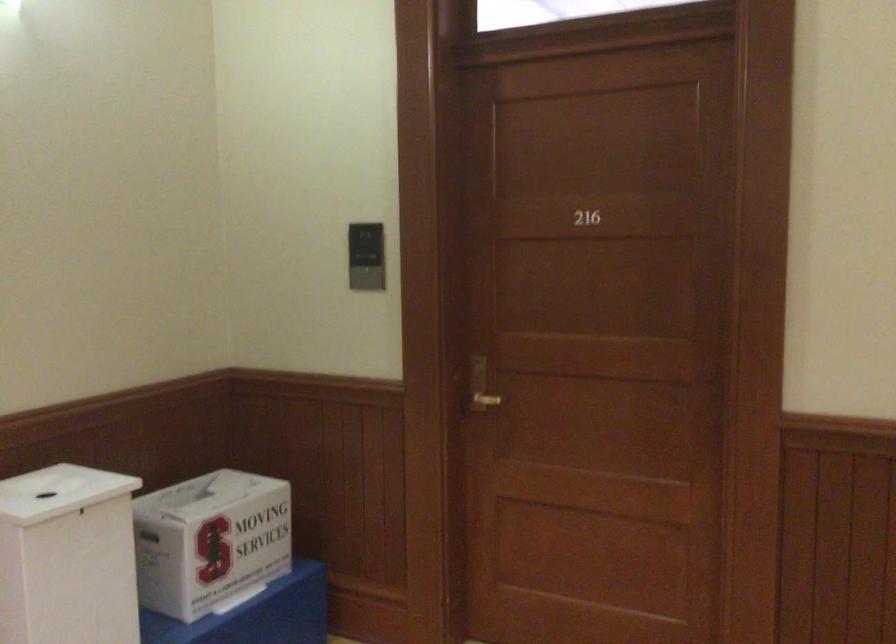
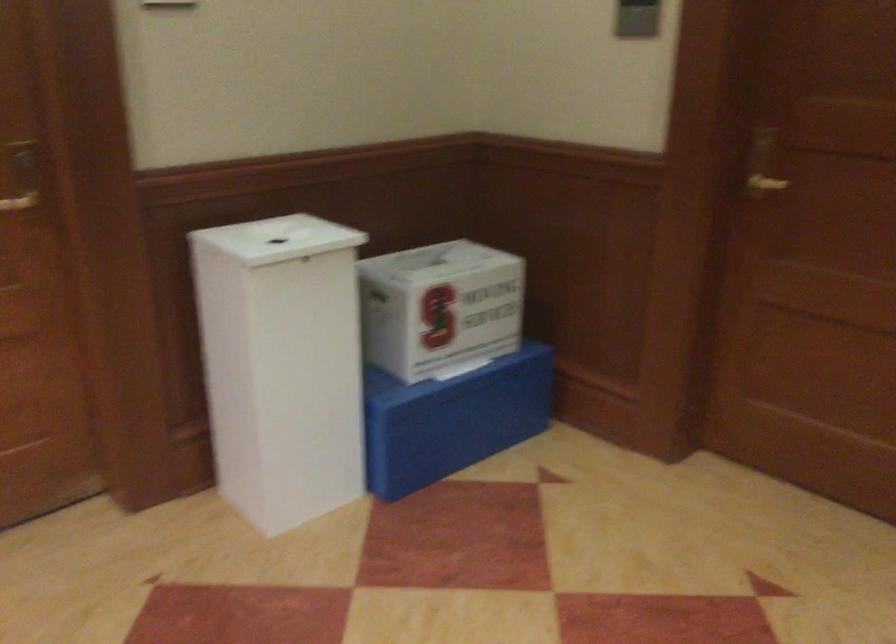
Locate, in the second image, the point that corresponds to (216,540) in the first image.

(440, 307)